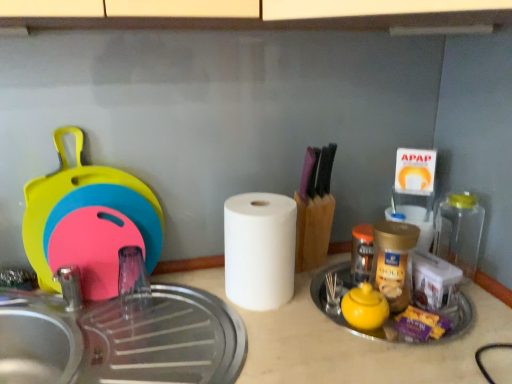
Image resolution: width=512 pixels, height=384 pixels. In order to click on vacant space positioned to the left of purple plastic candy at lower right in this screenshot , I will do `click(358, 327)`.